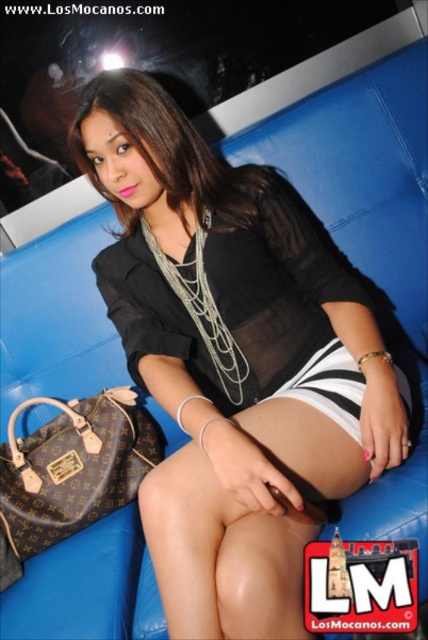
Does point (282, 360) come in front of point (291, 397)?

No, (282, 360) is behind (291, 397).

Based on the photo, between black sheer blouse at center and black and white striped shorts at lower center, which one appears on the left side from the viewer's perspective?

Positioned to the left is black sheer blouse at center.

The image size is (428, 640). I want to click on black sheer blouse at center, so click(234, 360).

Does black sheer dress at center lie in front of black and white striped shorts at lower center?

That is False.

Between point (226, 348) and point (339, 400), which one is positioned in front?

Point (339, 400) is more forward.

The height and width of the screenshot is (640, 428). Find the location of `black sheer dress at center`. black sheer dress at center is located at coordinates (232, 294).

What are the coordinates of `black sheer dress at center` in the screenshot? It's located at (232, 294).

Is black sheer blouse at center positioned at the back of brown leather handbag at lower left?

No, it is not.

Between black sheer blouse at center and brown leather handbag at lower left, which one appears on the right side from the viewer's perspective?

From the viewer's perspective, black sheer blouse at center appears more on the right side.

Is point (199, 589) positioned before point (20, 538)?

That is True.

You are a GUI agent. You are given a task and a screenshot of the screen. Output one action in this format:
    pyautogui.click(x=<x>, y=<y>)
    Task: Click on the black sheer blouse at center
    
    Given the screenshot: What is the action you would take?
    pyautogui.click(x=234, y=360)